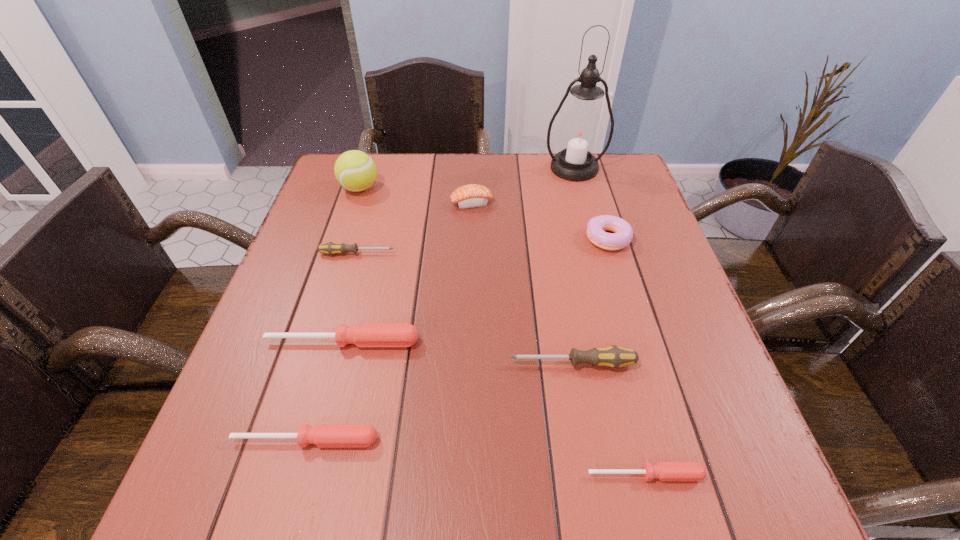
Image resolution: width=960 pixels, height=540 pixels. What are the coordinates of `the tallest object` in the screenshot? It's located at coord(580,133).

Identify the location of tennis ball. (354, 170).

Locate an element on the screen. This screenshot has height=540, width=960. green tennis ball is located at coordinates (354, 170).

Identify the location of sushi. (472, 195).

Identify the location of the fifth object from right to left. (472, 195).

The width and height of the screenshot is (960, 540). I want to click on doughnut, so click(x=623, y=233).

In order to click on the right gray screwdriver in this screenshot , I will do `click(613, 356)`.

Locate an element on the screen. This screenshot has width=960, height=540. the nearer gray screwdriver is located at coordinates (613, 356).

Find the location of a particular element. This screenshot has height=540, width=960. the farthest red screwdriver is located at coordinates (364, 334).

At what (x,y) coordinates should I click in order to perform the action: click on the second farthest screwdriver. Please return your answer as a coordinate pair (x, y). Looking at the image, I should click on (364, 334).